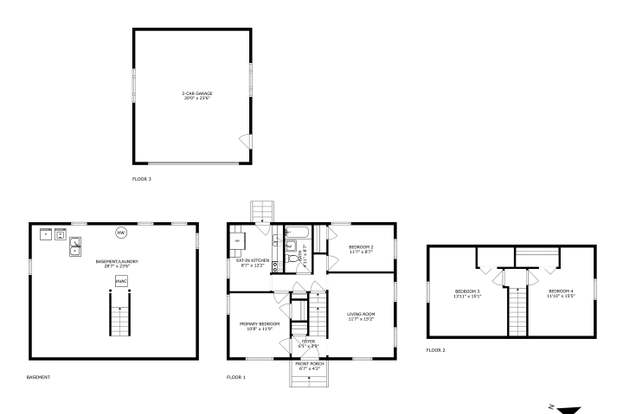
Identify the location of bathroom. (310, 267).